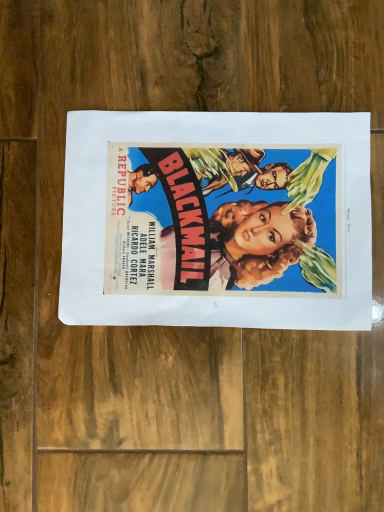
This screenshot has width=384, height=512. I want to click on empty space that is ontop of matte paper poster at center, so click(x=211, y=213).